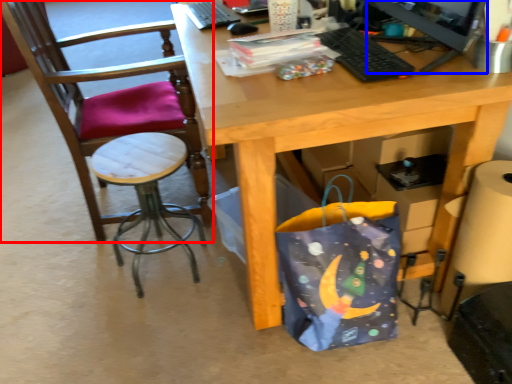
Question: Which object is closer to the camera taking this photo, chair (highlighted by a red box) or computer monitor (highlighted by a blue box)?

Choices:
 (A) chair
 (B) computer monitor

Answer: (B)